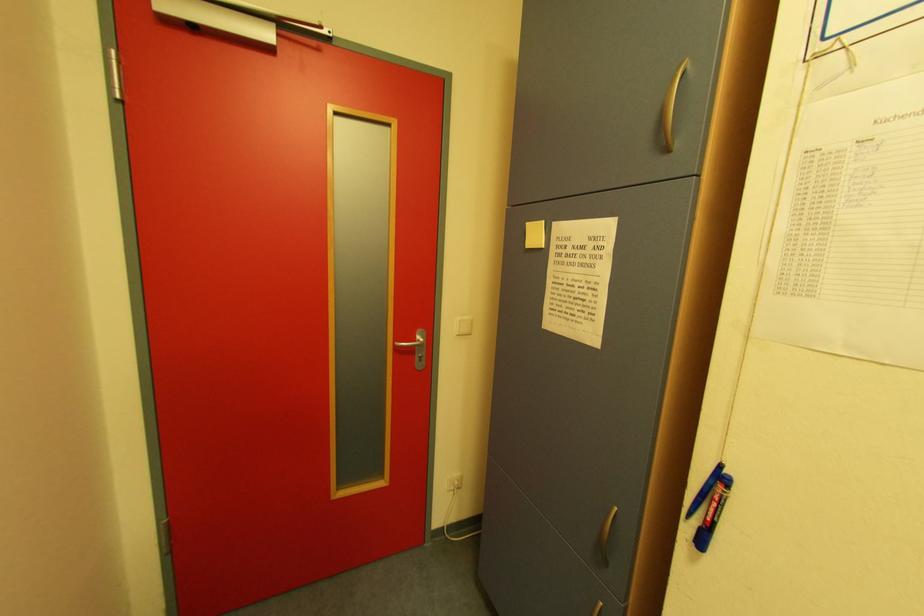
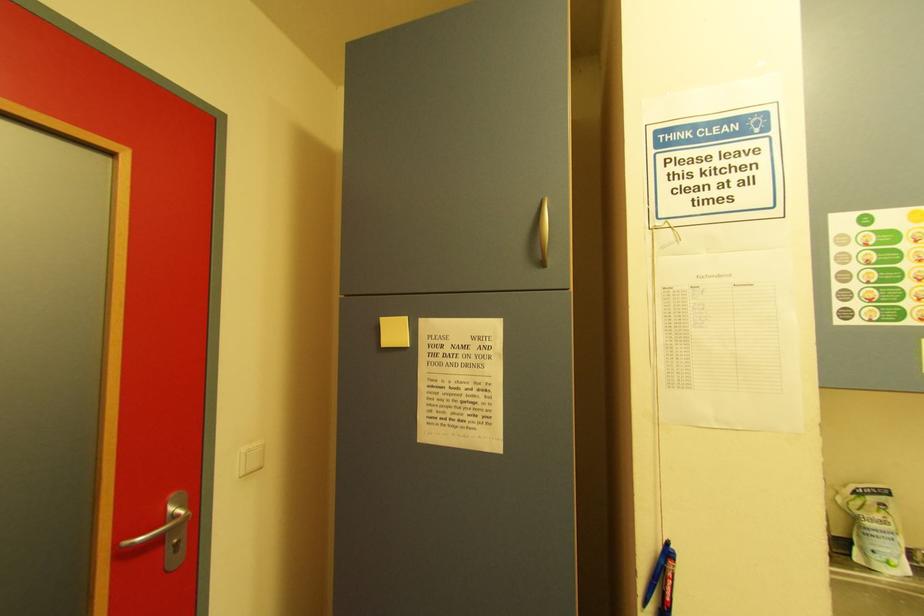
Question: The first image is from the beginning of the video and the second image is from the end. How did the camera likely rotate when shooting the video?

Choices:
 (A) Left
 (B) Right
 (C) Up
 (D) Down

Answer: (B)